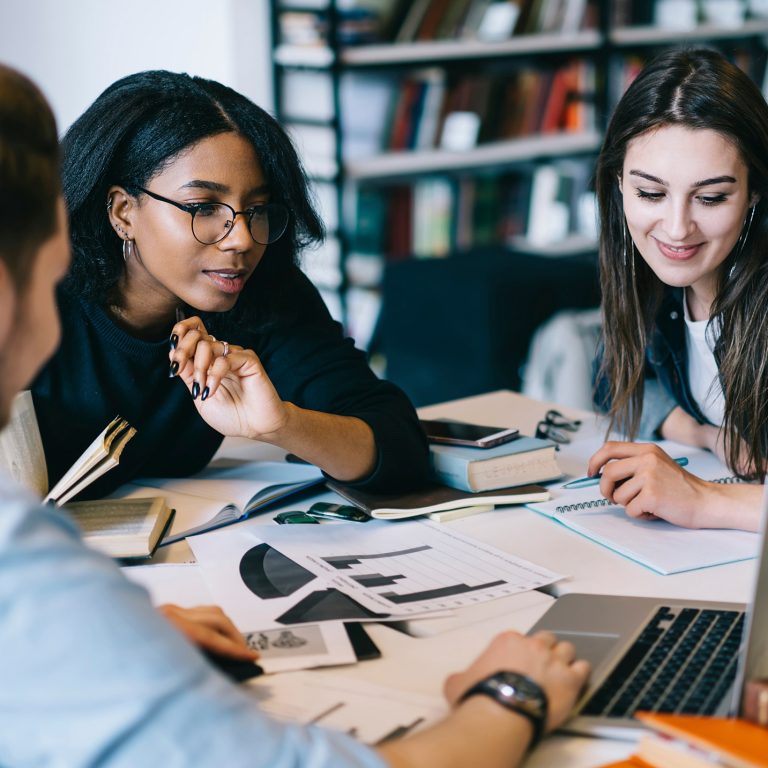
Identify the location of pen. (588, 480).